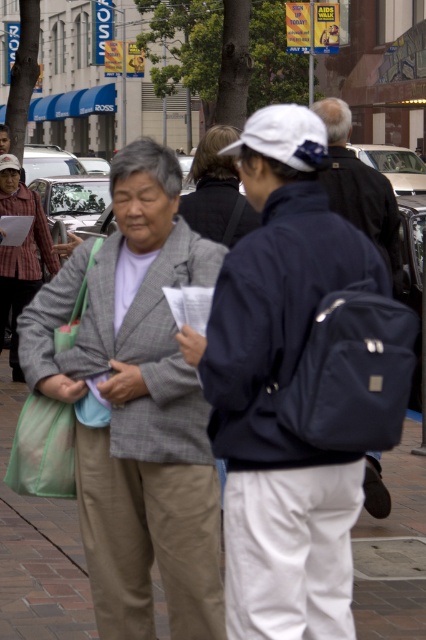
Question: Does matte blue backpack at center lie behind plaid shirt at center?

Choices:
 (A) yes
 (B) no

Answer: (B)

Question: Can you confirm if gray wool jacket at center is thinner than matte blue backpack at center?

Choices:
 (A) no
 (B) yes

Answer: (A)

Question: Considering the real-world distances, which object is farthest from the dark gray sweater at center?

Choices:
 (A) gray wool jacket at center
 (B) matte blue backpack at center
 (C) plaid shirt at center

Answer: (C)

Question: Estimate the real-world distances between objects in this image. Which object is farther from the matte blue backpack at center?

Choices:
 (A) plaid shirt at center
 (B) gray wool jacket at center
 (C) dark gray sweater at center

Answer: (A)

Question: Is gray wool jacket at center closer to the viewer compared to dark gray sweater at center?

Choices:
 (A) yes
 (B) no

Answer: (A)

Question: Which point is farther from the camera taking this photo?

Choices:
 (A) (344, 202)
 (B) (229, 205)

Answer: (A)